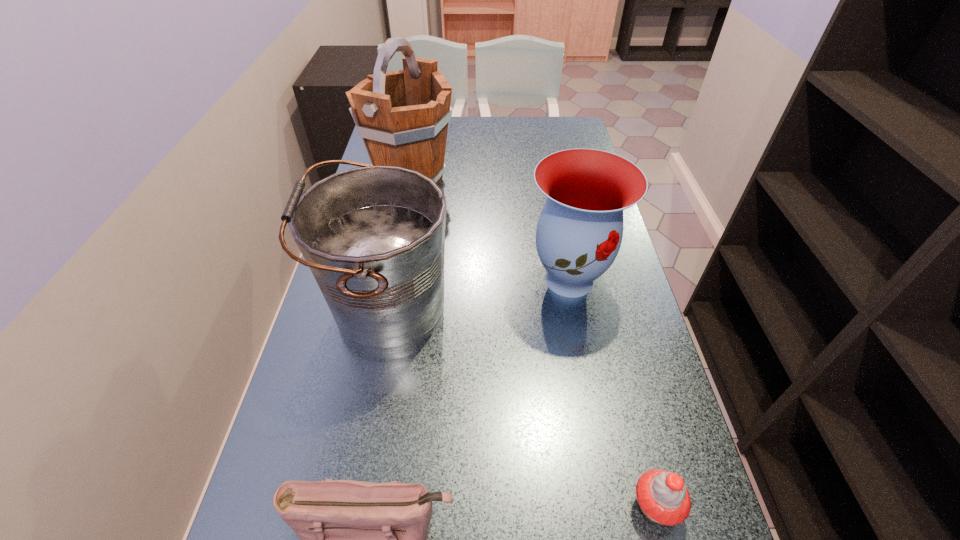
Where is `free space between the cupcake and the shorter bucket`? The width and height of the screenshot is (960, 540). free space between the cupcake and the shorter bucket is located at coordinates (523, 408).

This screenshot has width=960, height=540. I want to click on the closest object to the taller bucket, so click(x=373, y=237).

Identify the location of object that is the second closest to the shorter bucket. (359, 539).

I want to click on free spot that satisfies the following two spatial constraints: 1. on the front side of the nearer bucket; 2. on the right side of the taller bucket, so click(384, 310).